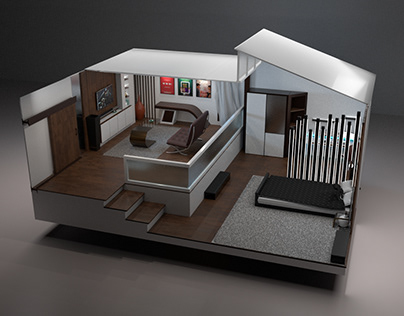
What are the coordinates of `center of legs on the side of the couch` in the screenshot? It's located at (178, 150).